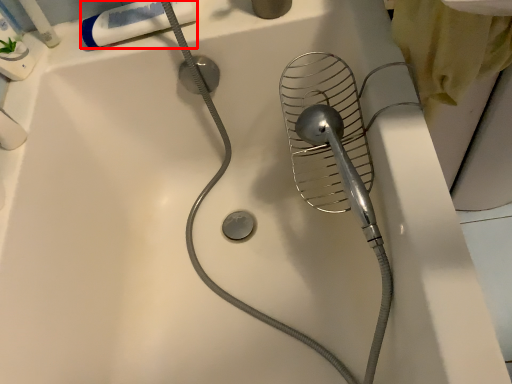
Question: Where is toothpaste (annotated by the red box) located in relation to toiletry in the image?

Choices:
 (A) left
 (B) right

Answer: (B)